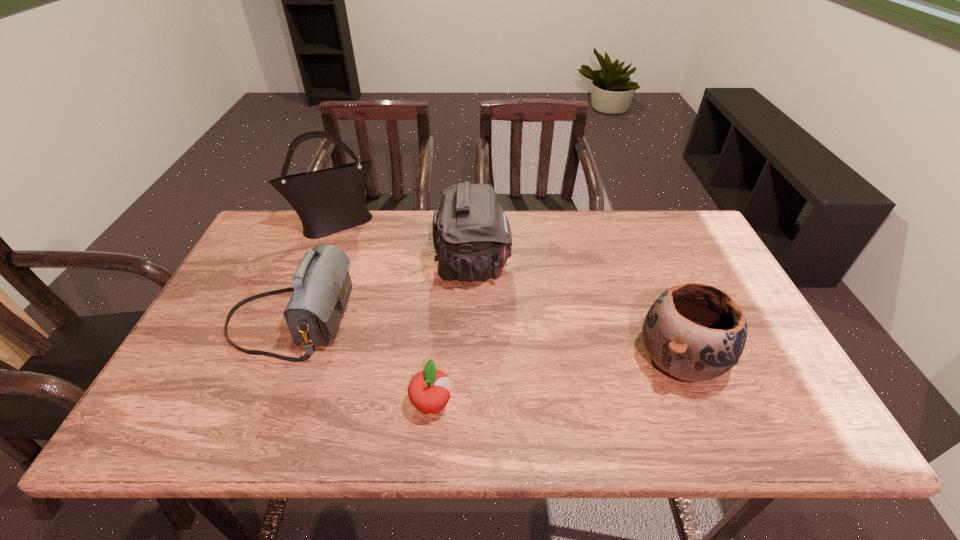
This screenshot has height=540, width=960. I want to click on vacant point located between the shortest object and the rightmost object, so click(x=556, y=382).

Locate an element on the screen. The height and width of the screenshot is (540, 960). free space between the apple and the pottery is located at coordinates (556, 382).

What are the coordinates of `vacant area that lies between the pottery and the fourth shortest object` in the screenshot? It's located at (576, 313).

You are a GUI agent. You are given a task and a screenshot of the screen. Output one action in this format:
    pyautogui.click(x=<x>, y=<y>)
    Task: Click on the empty space that is in between the apple and the second tallest object
    This screenshot has width=960, height=540.
    Given the screenshot: What is the action you would take?
    pyautogui.click(x=452, y=335)

At what (x,y) coordinates should I click in order to perform the action: click on vacant space that's between the shortest shoulder bag and the second tallest shoulder bag. Please return your answer as a coordinate pair (x, y). The width and height of the screenshot is (960, 540). Looking at the image, I should click on (381, 293).

Where is `free point between the shortest object and the tallest shoulder bag`? The width and height of the screenshot is (960, 540). free point between the shortest object and the tallest shoulder bag is located at coordinates (384, 315).

Locate an element on the screen. The image size is (960, 540). free space between the shortest object and the shortest shoulder bag is located at coordinates (361, 362).

This screenshot has width=960, height=540. What are the coordinates of `unoccupied position between the pottery and the second tallest shoulder bag` in the screenshot? It's located at (576, 313).

This screenshot has height=540, width=960. What are the coordinates of `free space between the rightmost object and the shortest shoulder bag` in the screenshot? It's located at pyautogui.click(x=485, y=340).

Where is `vacant point located between the rightmost shoulder bag and the shortest shoulder bag`? vacant point located between the rightmost shoulder bag and the shortest shoulder bag is located at coordinates (381, 293).